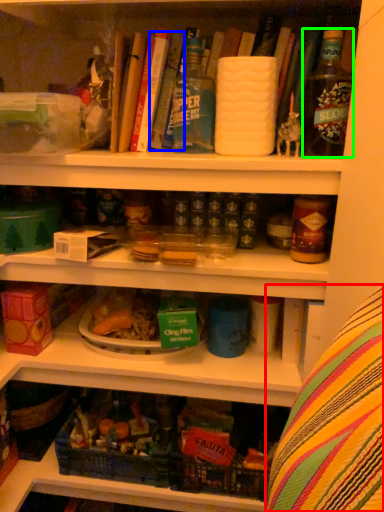
Question: Estimate the real-world distances between objects in this image. Which object is farther from leftover (highlighted by a red box), book (highlighted by a blue box) or bottle (highlighted by a green box)?

Choices:
 (A) book
 (B) bottle

Answer: (A)